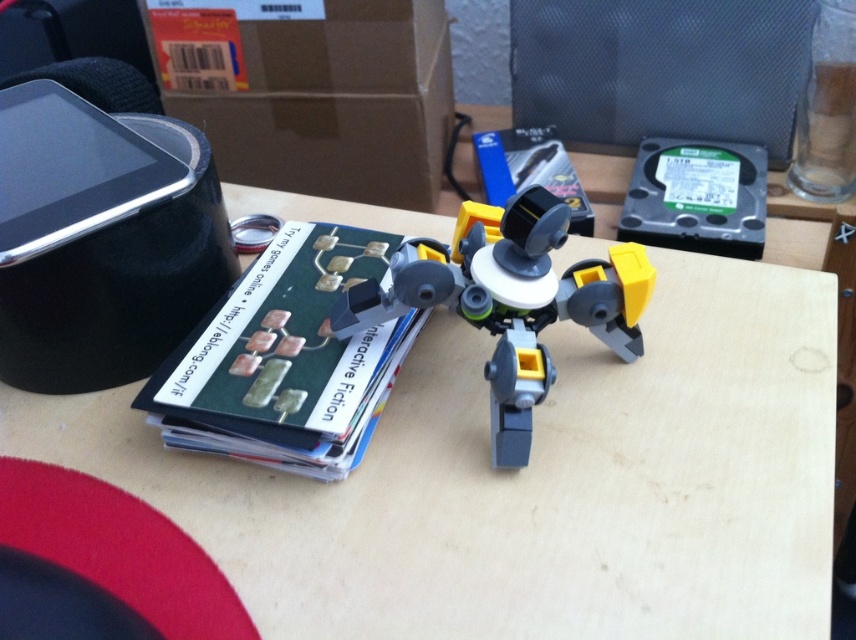
You are organizing items on a desk and see the matte plastic book at center and the gray plastic robot at center. According to the scene, which object is positioned higher up?

The matte plastic book at center is located above the gray plastic robot at center, so it is positioned higher up.

You are a small toy robot with a maximum reach of 4 inches. You are currently positioned on a desk and want to pick up the matte plastic book at center. Can you reach it from your current position near the gray plastic robot at center?

The distance between the matte plastic book at center and the gray plastic robot at center is 4.32 inches, which exceeds your 4 inch reach. Therefore, you cannot reach the matte plastic book at center from your current position.